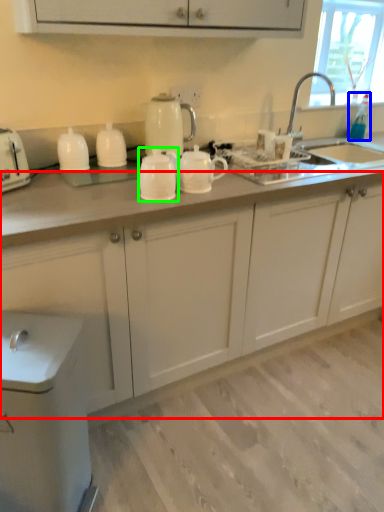
Question: Based on their relative distances, which object is farther from cabinetry (highlighted by a red box)? Choose from bottle (highlighted by a blue box) and tableware (highlighted by a green box).

Choices:
 (A) bottle
 (B) tableware

Answer: (A)